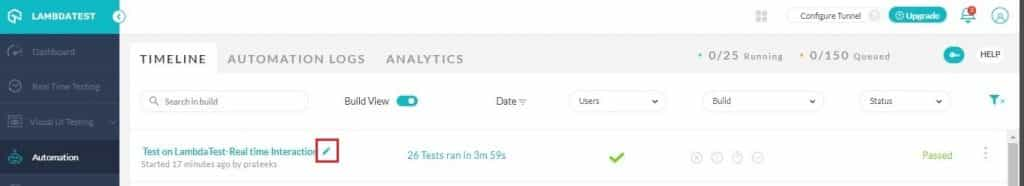
At what (x,y) coordinates should I click in order to perform the action: click on side bar. Please return your answer as a coordinate pair (x, y). Looking at the image, I should click on (50, 15).